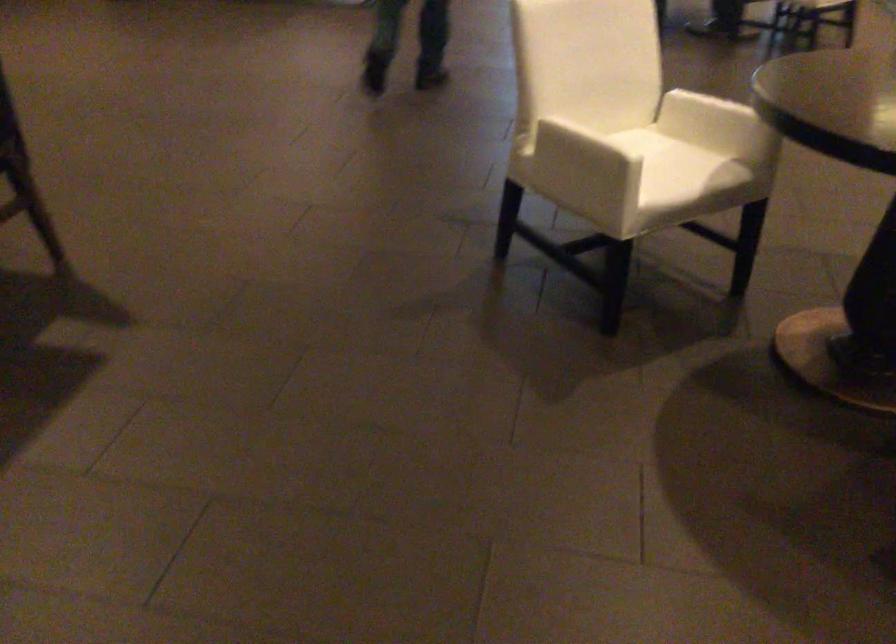
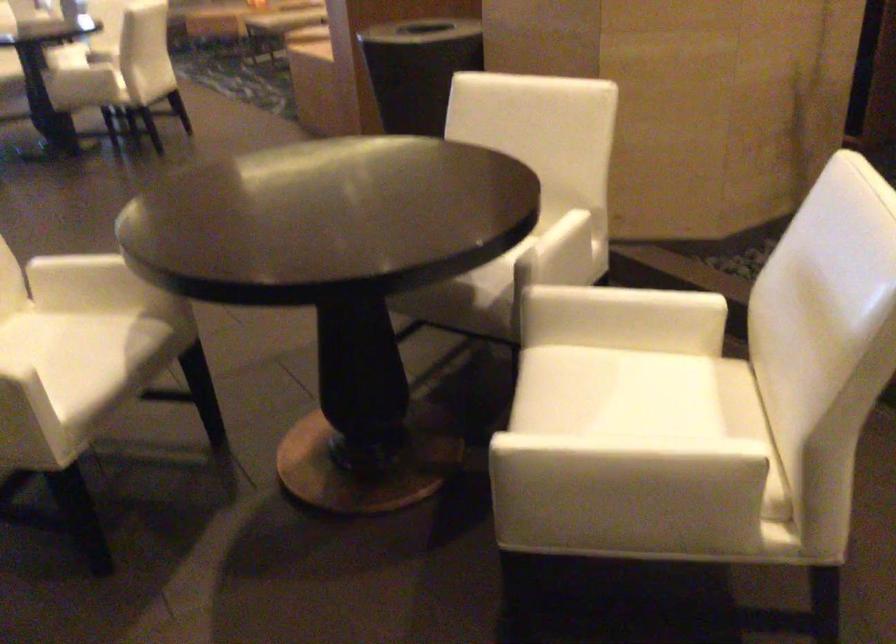
In the second image, find the point that corresponds to pixel 698 111 in the first image.

(80, 279)